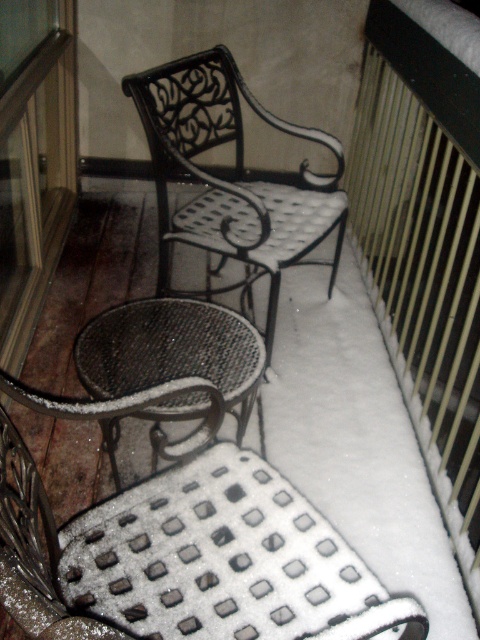
Question: Does metallic mesh chair at lower center have a smaller size compared to black wrought iron chair at center?

Choices:
 (A) no
 (B) yes

Answer: (B)

Question: Which of the following is the closest to the observer?

Choices:
 (A) metallic mesh table at center
 (B) black wrought iron chair at center

Answer: (A)

Question: Estimate the real-world distances between objects in this image. Which object is farther from the metallic mesh chair at lower center?

Choices:
 (A) metallic mesh table at center
 (B) black wrought iron chair at center

Answer: (B)

Question: In this image, where is black wrought iron chair at center located relative to metallic mesh table at center?

Choices:
 (A) left
 (B) right

Answer: (B)

Question: Which object appears farthest from the camera in this image?

Choices:
 (A) metallic mesh chair at lower center
 (B) black wrought iron chair at center
 (C) metallic mesh table at center

Answer: (B)

Question: Is metallic mesh chair at lower center bigger than black wrought iron chair at center?

Choices:
 (A) yes
 (B) no

Answer: (B)